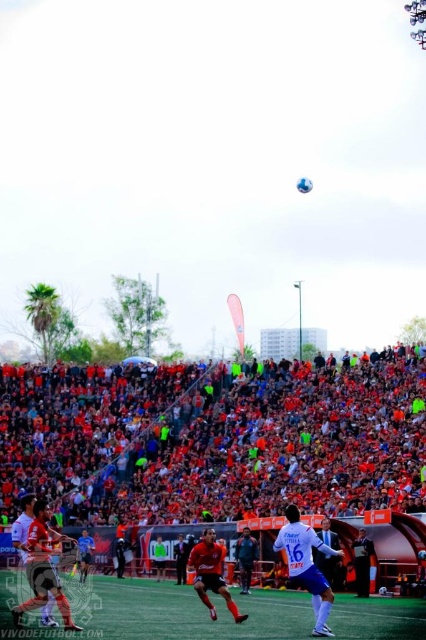
Can you confirm if orange fabric crowd at center is positioned to the left of green artificial turf at center?

In fact, orange fabric crowd at center is to the right of green artificial turf at center.

The height and width of the screenshot is (640, 426). Describe the element at coordinates (216, 440) in the screenshot. I see `orange fabric crowd at center` at that location.

You are a GUI agent. You are given a task and a screenshot of the screen. Output one action in this format:
    pyautogui.click(x=<x>, y=<y>)
    Task: Click on the orange fabric crowd at center
    This screenshot has width=426, height=640.
    Given the screenshot: What is the action you would take?
    pyautogui.click(x=216, y=440)

Does green artificial turf at center have a smaller size compared to white matte jersey at center?

Actually, green artificial turf at center might be larger than white matte jersey at center.

Is green artificial turf at center shorter than white matte jersey at center?

Indeed, green artificial turf at center has a lesser height compared to white matte jersey at center.

Which is in front, point (104, 605) or point (279, 532)?

Point (279, 532) is in front.

Where is `green artificial turf at center`? The width and height of the screenshot is (426, 640). green artificial turf at center is located at coordinates (192, 612).

Is orange fabric crowd at center smaller than white matte jersey at center?

Incorrect, orange fabric crowd at center is not smaller in size than white matte jersey at center.

Does orange fabric crowd at center have a greater width compared to white matte jersey at center?

Indeed, orange fabric crowd at center has a greater width compared to white matte jersey at center.

This screenshot has width=426, height=640. What do you see at coordinates (216, 440) in the screenshot? I see `orange fabric crowd at center` at bounding box center [216, 440].

Identify the location of orange fabric crowd at center. This screenshot has height=640, width=426. (216, 440).